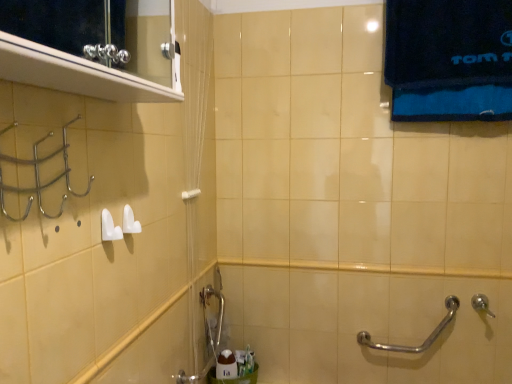
Question: Is the depth of white glossy soap at lower center greater than that of metallic silver medicine cabinet at upper left?

Choices:
 (A) no
 (B) yes

Answer: (B)

Question: Does white glossy soap at lower center appear on the left side of metallic silver medicine cabinet at upper left?

Choices:
 (A) yes
 (B) no

Answer: (B)

Question: Could you tell me if white glossy soap at lower center is facing metallic silver medicine cabinet at upper left?

Choices:
 (A) no
 (B) yes

Answer: (A)

Question: Is the surface of white glossy soap at lower center in direct contact with metallic silver medicine cabinet at upper left?

Choices:
 (A) no
 (B) yes

Answer: (A)

Question: Is white glossy soap at lower center positioned beyond the bounds of metallic silver medicine cabinet at upper left?

Choices:
 (A) no
 (B) yes

Answer: (B)

Question: In terms of size, does dark blue cotton towel at upper right appear bigger or smaller than brushed metal faucet at lower center?

Choices:
 (A) small
 (B) big

Answer: (B)

Question: From a real-world perspective, is dark blue cotton towel at upper right physically located above or below brushed metal faucet at lower center?

Choices:
 (A) above
 (B) below

Answer: (A)

Question: From their relative heights in the image, would you say dark blue cotton towel at upper right is taller or shorter than brushed metal faucet at lower center?

Choices:
 (A) tall
 (B) short

Answer: (A)

Question: Considering the positions of dark blue cotton towel at upper right and brushed metal faucet at lower center in the image, is dark blue cotton towel at upper right wider or thinner than brushed metal faucet at lower center?

Choices:
 (A) thin
 (B) wide

Answer: (A)

Question: Considering the positions of point (478, 304) and point (421, 347), is point (478, 304) closer or farther from the camera than point (421, 347)?

Choices:
 (A) farther
 (B) closer

Answer: (B)

Question: From a real-world perspective, is silver metallic shower at lower right above or below silver metallic grab bar at lower right?

Choices:
 (A) below
 (B) above

Answer: (B)

Question: Would you say silver metallic shower at lower right is inside or outside silver metallic grab bar at lower right?

Choices:
 (A) inside
 (B) outside

Answer: (B)

Question: From their relative heights in the image, would you say silver metallic shower at lower right is taller or shorter than silver metallic grab bar at lower right?

Choices:
 (A) short
 (B) tall

Answer: (A)

Question: In terms of size, does silver metallic grab bar at lower right appear bigger or smaller than white glossy soap at lower center?

Choices:
 (A) small
 (B) big

Answer: (B)

Question: Looking at their shapes, would you say silver metallic grab bar at lower right is wider or thinner than white glossy soap at lower center?

Choices:
 (A) thin
 (B) wide

Answer: (A)